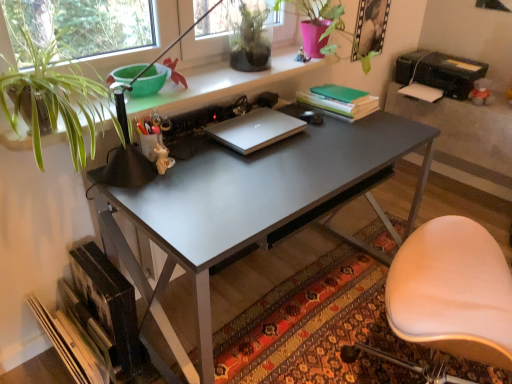
You are a GUI agent. You are given a task and a screenshot of the screen. Output one action in this format:
    pyautogui.click(x=<x>, y=<y>)
    Task: Click on the free space to the right of matte white figurine at center
    The height and width of the screenshot is (384, 512).
    Given the screenshot: What is the action you would take?
    pyautogui.click(x=209, y=173)